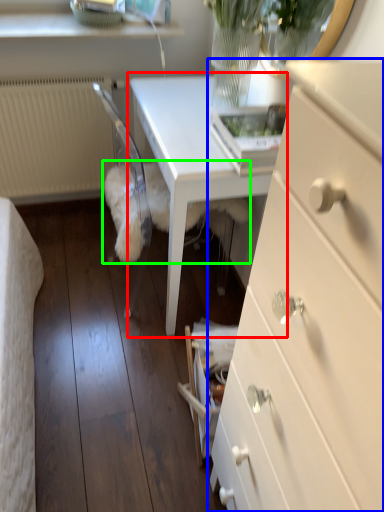
Question: Based on their relative distances, which object is farther from table (highlighted by a red box)? Choose from chest of drawers (highlighted by a blue box) and animal (highlighted by a green box).

Choices:
 (A) chest of drawers
 (B) animal

Answer: (A)